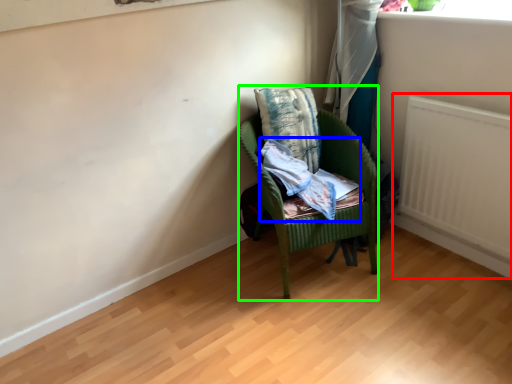
Question: Which object is positioned closest to radiator (highlighted by a red box)? Select from clothing (highlighted by a blue box) and chair (highlighted by a green box).

Choices:
 (A) clothing
 (B) chair

Answer: (B)